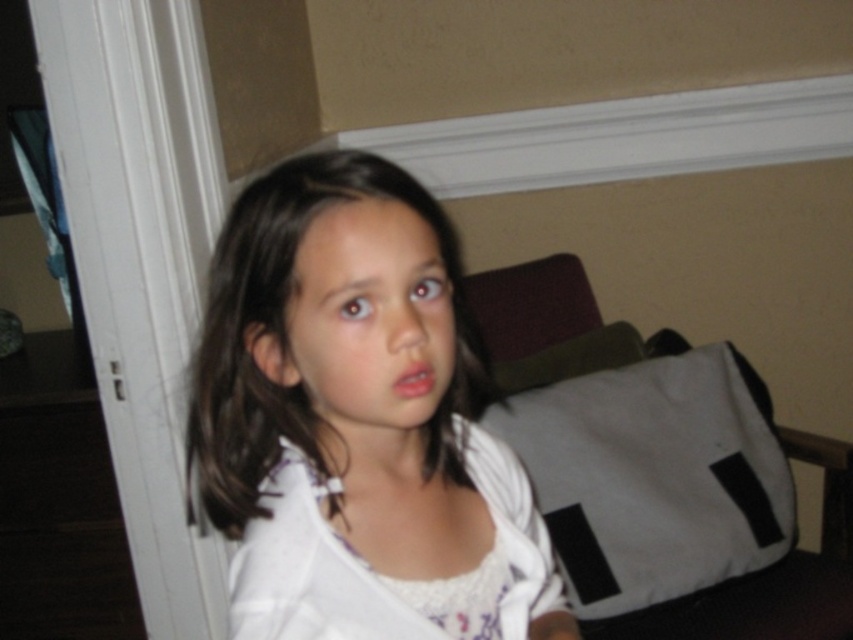
Consider the image. You are a fashion designer observing a model wearing both the smooth white shirt at center and the white textured dress at center. Which clothing item reaches a higher point on the model?

The smooth white shirt at center is taller than the white textured dress at center, so the smooth white shirt at center reaches a higher point on the model.

Where is the smooth white shirt at center positioned in the image?

The smooth white shirt at center is positioned at coordinates point (355, 413).

You are standing in the room and see two points marked on the wall. One is at point [413,579] and the other at point [537,579]. Which point is closer to you?

Point [413,579] is in front of point [537,579], so it is closer to you.